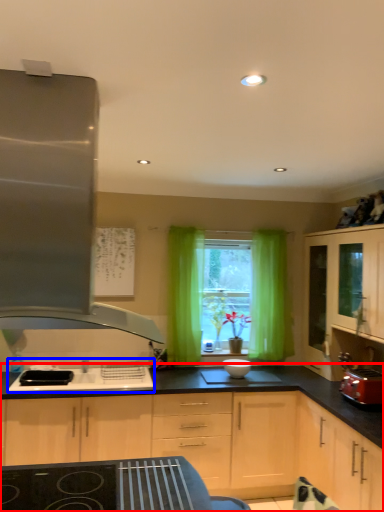
Question: Which object appears closest to the camera in this image, cabinetry (highlighted by a red box) or sink (highlighted by a blue box)?

Choices:
 (A) cabinetry
 (B) sink

Answer: (A)